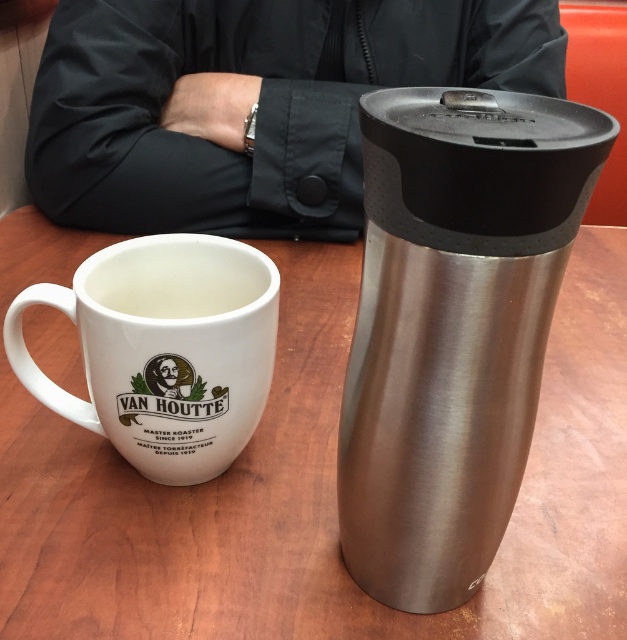
Question: Considering the real-world distances, which object is farthest from the black fabric jacket at upper center?

Choices:
 (A) wooden table at center
 (B) brushed metal thermos at right

Answer: (B)

Question: Estimate the real-world distances between objects in this image. Which object is closer to the black fabric jacket at upper center?

Choices:
 (A) wooden table at center
 (B) brushed metal thermos at right
 (C) white ceramic mug at left

Answer: (A)

Question: Is the position of wooden table at center less distant than that of brushed metal thermos at right?

Choices:
 (A) yes
 (B) no

Answer: (B)

Question: Which of the following is the closest to the observer?

Choices:
 (A) (140, 432)
 (B) (529, 413)

Answer: (B)

Question: Observing the image, what is the correct spatial positioning of wooden table at center in reference to white ceramic mug at left?

Choices:
 (A) left
 (B) right

Answer: (B)

Question: Considering the relative positions of black fabric jacket at upper center and white ceramic mug at left in the image provided, where is black fabric jacket at upper center located with respect to white ceramic mug at left?

Choices:
 (A) right
 (B) left

Answer: (A)